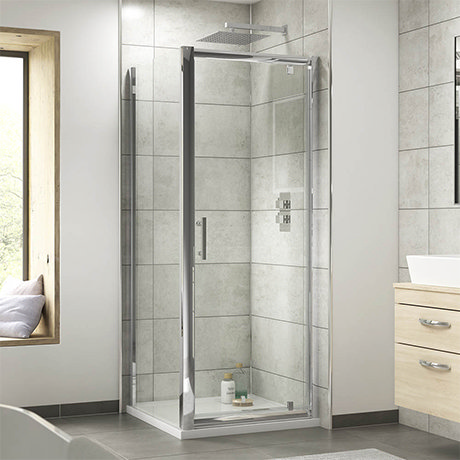
The width and height of the screenshot is (460, 460). I want to click on tile, so click(x=290, y=440).